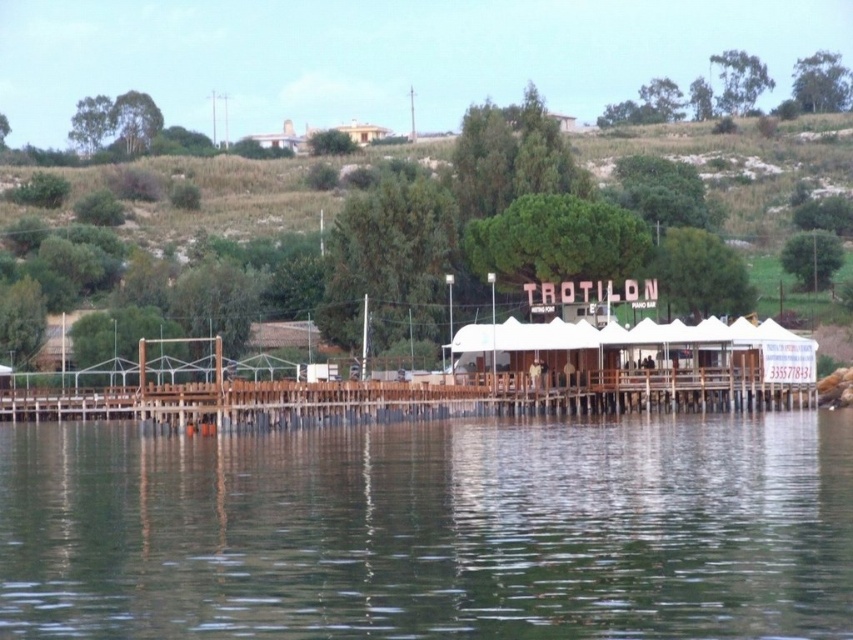
You are standing at the edge of the lake and see the transparent water at lower center and the wooden dock at center. Which one is nearer to you?

The transparent water at lower center is closer to the viewer than the wooden dock at center, so the transparent water at lower center is nearer to you.

Consider the image. You are standing on the wooden dock at center and want to see the transparent water at lower center. In which direction should you look?

The transparent water at lower center is below the wooden dock at center, so you should look downward to see it.